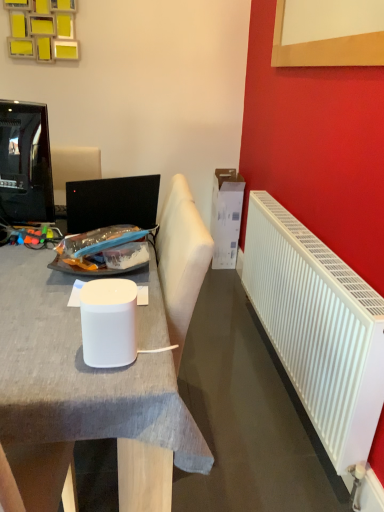
Find the location of a particular element. white glossy paper cup at center is located at coordinates (108, 322).

What do you see at coordinates (226, 217) in the screenshot? The height and width of the screenshot is (512, 384). I see `white cardboard box at upper right` at bounding box center [226, 217].

The height and width of the screenshot is (512, 384). Describe the element at coordinates (59, 361) in the screenshot. I see `white matte desk at center` at that location.

What are the coordinates of `white glossy paper cup at center` in the screenshot? It's located at (108, 322).

Which of these two, white cardboard box at upper right or white glossy paper cup at center, is wider?

Wider between the two is white cardboard box at upper right.

The width and height of the screenshot is (384, 512). I want to click on paper cup above the white cardboard box at upper right (from a real-world perspective), so click(108, 322).

Can you confirm if white cardboard box at upper right is shorter than white glossy paper cup at center?

No.

Considering the relative sizes of white matte desk at center and white glossy paper cup at center in the image provided, is white matte desk at center taller than white glossy paper cup at center?

Indeed, white matte desk at center has a greater height compared to white glossy paper cup at center.

Measure the distance between white matte desk at center and white glossy paper cup at center.

A distance of 7.26 inches exists between white matte desk at center and white glossy paper cup at center.

Which object is positioned more to the right, white matte desk at center or white glossy paper cup at center?

Positioned to the right is white glossy paper cup at center.

Considering the positions of objects white matte desk at center and white glossy paper cup at center in the image provided, who is in front, white matte desk at center or white glossy paper cup at center?

white glossy paper cup at center is in front.

Based on the photo, considering the sizes of objects matte black television at left and white cardboard box at upper right in the image provided, who is bigger, matte black television at left or white cardboard box at upper right?

With larger size is white cardboard box at upper right.

Is matte black television at left inside or outside of white cardboard box at upper right?

matte black television at left exists outside the volume of white cardboard box at upper right.

Which is more to the left, matte black television at left or white cardboard box at upper right?

matte black television at left.

How much distance is there between matte black television at left and white cardboard box at upper right?

matte black television at left is 5.67 feet away from white cardboard box at upper right.

What's the angular difference between white glossy paper cup at center and white matte desk at center's facing directions?

90 degrees.

From a real-world perspective, is white glossy paper cup at center positioned over white matte desk at center based on gravity?

Yes, from a real-world perspective, white glossy paper cup at center is above white matte desk at center.

Considering the relative positions of white glossy paper cup at center and white matte desk at center in the image provided, is white glossy paper cup at center to the left or to the right of white matte desk at center?

In the image, white glossy paper cup at center appears on the right side of white matte desk at center.

Which point is more forward, (95,341) or (155,381)?

The point (155,381) is closer to the camera.

Which of these two, matte black television at left or white matte desk at center, stands taller?

white matte desk at center is taller.

From the image's perspective, which object appears higher, matte black television at left or white matte desk at center?

From the image's view, matte black television at left is above.

You are a GUI agent. You are given a task and a screenshot of the screen. Output one action in this format:
    pyautogui.click(x=<x>, y=<y>)
    Task: Click on the television positioned vertically above the white matte desk at center (from a real-world perspective)
    This screenshot has width=384, height=512.
    Given the screenshot: What is the action you would take?
    pyautogui.click(x=25, y=163)

Considering the positions of objects matte black television at left and white matte desk at center in the image provided, who is more to the left, matte black television at left or white matte desk at center?

From the viewer's perspective, matte black television at left appears more on the left side.

Can white cardboard box at upper right be found inside white plastic radiator at right?

No.

Does white plastic radiator at right have a greater height compared to white cardboard box at upper right?

No.

Could you tell me if white plastic radiator at right is facing white cardboard box at upper right?

No, white plastic radiator at right is not aimed at white cardboard box at upper right.

Who is more distant, white plastic radiator at right or white cardboard box at upper right?

white cardboard box at upper right is more distant.

Does white matte desk at center have a lesser width compared to white plastic radiator at right?

No, white matte desk at center is not thinner than white plastic radiator at right.

Is point (138, 503) positioned after point (370, 390)?

No.

From the picture: Is white matte desk at center placed right next to white plastic radiator at right?

white matte desk at center and white plastic radiator at right are not in contact.

This screenshot has width=384, height=512. In order to click on paper cup below the white cardboard box at upper right (from the image's perspective) in this screenshot , I will do `click(108, 322)`.

Identify the location of desk located behind the white glossy paper cup at center. This screenshot has width=384, height=512. (59, 361).

Considering their positions, is white glossy paper cup at center positioned further to white plastic radiator at right than white cardboard box at upper right?

Based on the image, white cardboard box at upper right appears to be further to white plastic radiator at right.

Estimate the real-world distances between objects in this image. Which object is further from white cardboard box at upper right, white plastic radiator at right or matte black television at left?

The object further to white cardboard box at upper right is matte black television at left.

Looking at the image, which one is located further to white glossy paper cup at center, white plastic radiator at right or white cardboard box at upper right?

white cardboard box at upper right lies further to white glossy paper cup at center than the other object.

Based on their spatial positions, is white glossy paper cup at center or white matte desk at center closer to white cardboard box at upper right?

The object closer to white cardboard box at upper right is white matte desk at center.

Considering their positions, is white plastic radiator at right positioned further to matte black television at left than white matte desk at center?

white plastic radiator at right is positioned further to the anchor matte black television at left.

From the image, which object appears to be nearer to matte black television at left, white glossy paper cup at center or white matte desk at center?

white matte desk at center is closer to matte black television at left.

Which object lies nearer to the anchor point matte black television at left, white plastic radiator at right or white cardboard box at upper right?

white plastic radiator at right.

Estimate the real-world distances between objects in this image. Which object is further from white plastic radiator at right, white matte desk at center or matte black television at left?

Among the two, matte black television at left is located further to white plastic radiator at right.

Image resolution: width=384 pixels, height=512 pixels. I want to click on radiator between white glossy paper cup at center and white cardboard box at upper right from front to back, so click(x=318, y=327).

This screenshot has width=384, height=512. Identify the location of paper cup located between white matte desk at center and white plastic radiator at right in the left-right direction. (108, 322).

Locate an element on the screen. The width and height of the screenshot is (384, 512). paper cup situated between matte black television at left and white plastic radiator at right from left to right is located at coordinates (108, 322).

Identify the location of television between white glossy paper cup at center and white cardboard box at upper right from front to back. (25, 163).